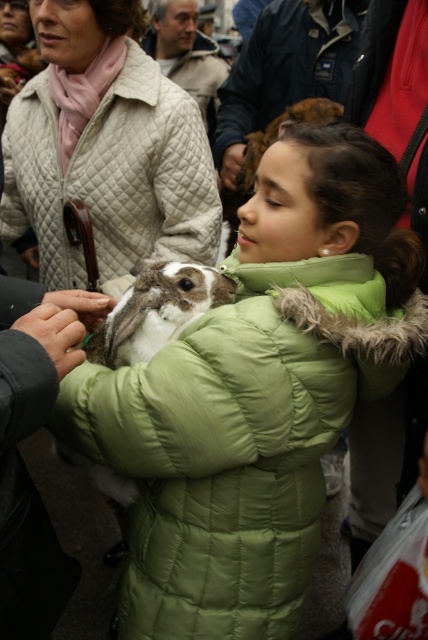
Identify the location of quilted beige jacket at upper left. The height and width of the screenshot is (640, 428). (112, 177).

Who is more distant from viewer, (83, 193) or (41, 344)?

The point (83, 193) is behind.

Find the location of `quilted beige jacket at upper left`. quilted beige jacket at upper left is located at coordinates (112, 177).

What do you see at coordinates (258, 394) in the screenshot? The width and height of the screenshot is (428, 640). I see `green quilted coat at center` at bounding box center [258, 394].

Locate an element on the screen. green quilted coat at center is located at coordinates (258, 394).

Based on the photo, does green quilted coat at center appear on the right side of white matte skin at center?

Yes, green quilted coat at center is to the right of white matte skin at center.

Is point (208, 401) positioned in front of point (70, 300)?

Yes, it is.

Does point (136, 448) lie in front of point (64, 307)?

Yes, it is.

Identify the location of green quilted coat at center. (258, 394).